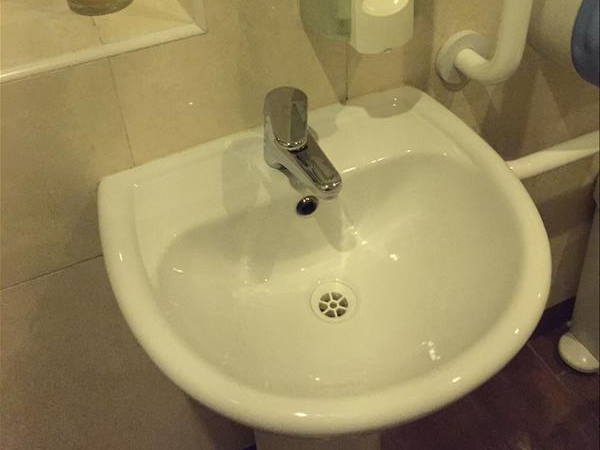
Locate an element on the screen. The image size is (600, 450). tap is located at coordinates (281, 122).